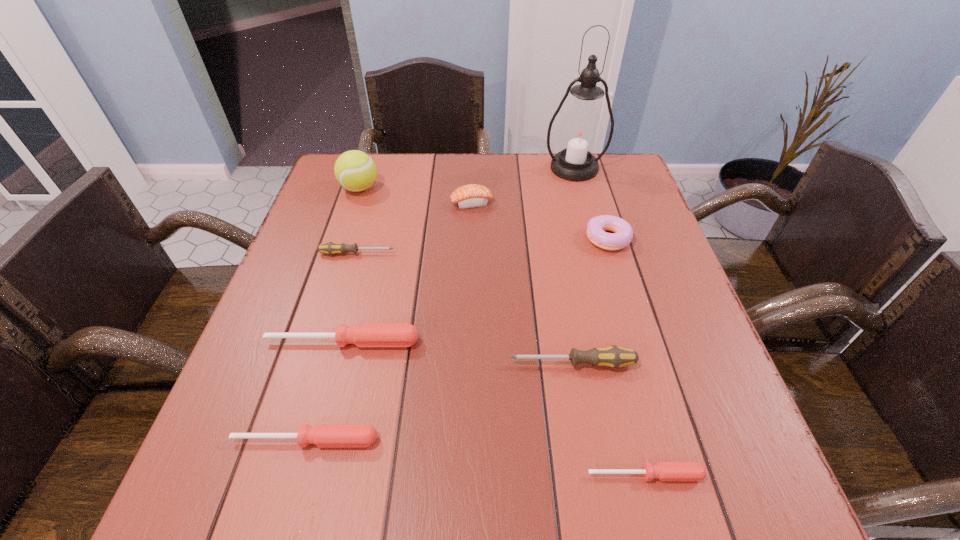
Identify the location of vacant space at the right edge of the desktop. (636, 237).

Find the location of a particular element. The width and height of the screenshot is (960, 540). empty location between the second nearest red screwdriver and the doughnut is located at coordinates (457, 339).

Locate an element on the screen. free area in between the fifth object from right to left and the right gray screwdriver is located at coordinates (522, 284).

Locate an element on the screen. This screenshot has width=960, height=540. blank region between the nearer gray screwdriver and the orange sushi is located at coordinates (522, 284).

Where is `free spot between the third nearest object and the tallest object`? The height and width of the screenshot is (540, 960). free spot between the third nearest object and the tallest object is located at coordinates (573, 266).

Find the location of a particular element. free space between the biggest red screwdriver and the sushi is located at coordinates 407,273.

Locate an element on the screen. free space between the nearer gray screwdriver and the purple doughnut is located at coordinates click(x=590, y=301).

The image size is (960, 540). In order to click on free space between the farther gray screwdriver and the second smallest red screwdriver in this screenshot , I will do `click(331, 347)`.

Identify the location of vacant area that lies between the green tennis ball and the smaller gray screwdriver. (358, 221).

Where is `empty location between the oil lamp and the smaller gray screwdriver`? The image size is (960, 540). empty location between the oil lamp and the smaller gray screwdriver is located at coordinates (466, 211).